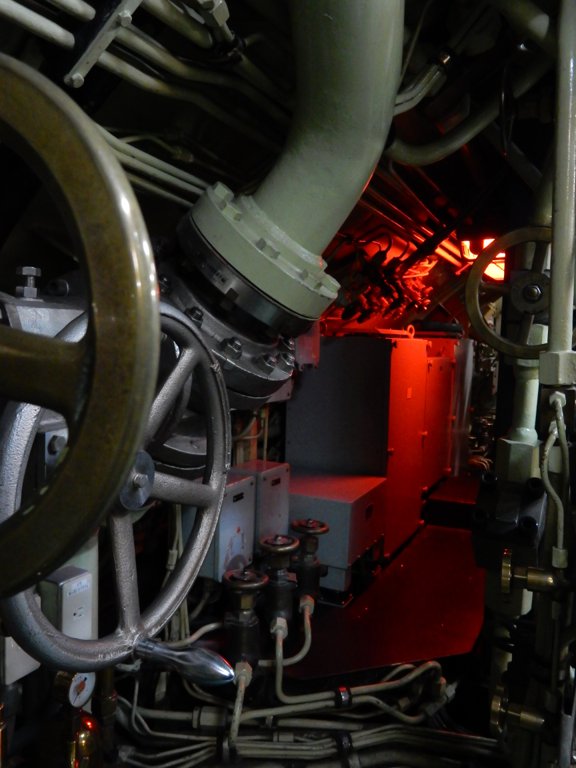
Find the location of a particular element. metal piping is located at coordinates (563, 429), (545, 455).